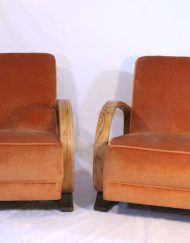
Where is `white wall in background`? white wall in background is located at coordinates (98, 29).